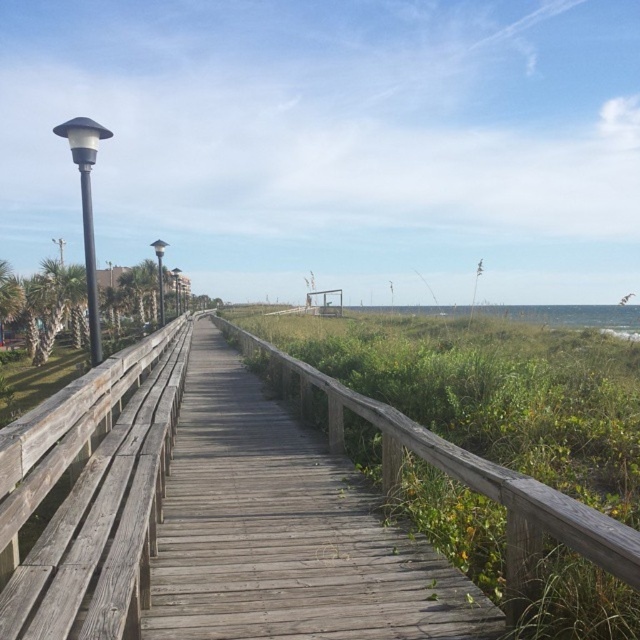
Who is more distant from viewer, (323, 554) or (140, 358)?

The point (140, 358) is more distant.

Locate an element on the screen. The height and width of the screenshot is (640, 640). weathered wood boardwalk at center is located at coordinates (285, 531).